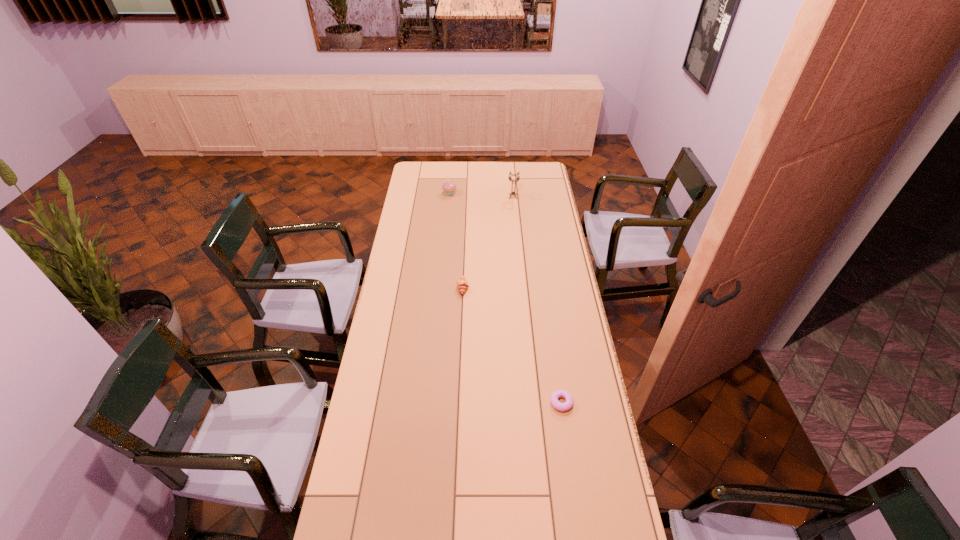
This screenshot has width=960, height=540. In order to click on free space located 0.170m on the front-facing side of the third object from right to left in this screenshot , I will do `click(507, 288)`.

This screenshot has width=960, height=540. What are the coordinates of `free region located on the front of the doughnut` in the screenshot? It's located at (575, 496).

The width and height of the screenshot is (960, 540). I want to click on object that is at the right edge, so click(562, 407).

I want to click on vacant space at the far edge, so click(449, 171).

Identify the location of vacant space at the left edge of the desktop. The image size is (960, 540). (396, 449).

Where is `vacant position at the right edge of the desktop`? This screenshot has height=540, width=960. vacant position at the right edge of the desktop is located at coordinates (543, 190).

In the image, there is a desktop. Find the location of `vacant area at the far left corner`. vacant area at the far left corner is located at coordinates (435, 171).

Image resolution: width=960 pixels, height=540 pixels. Identify the location of free region at the far right corner of the desktop. (547, 178).

You are a GUI agent. You are given a task and a screenshot of the screen. Output one action in this format:
    pyautogui.click(x=<x>, y=<y>)
    Task: Click on the free space that is in between the candle holder and the cupcake
    The width and height of the screenshot is (960, 540).
    Given the screenshot: What is the action you would take?
    pyautogui.click(x=481, y=195)

Identify the location of free space between the third object from left to right and the shortest object. (538, 300).